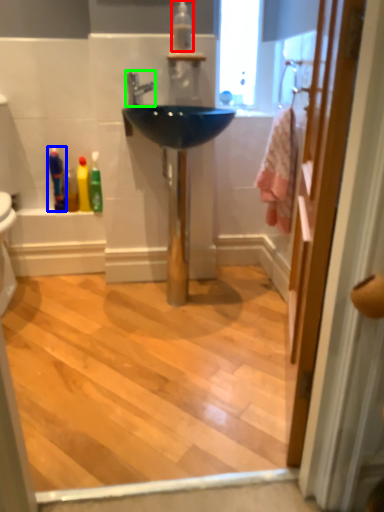
Question: Estimate the real-world distances between objects in this image. Which object is farther from mouthwash (highlighted by a red box), toiletry (highlighted by a blue box) or tap (highlighted by a green box)?

Choices:
 (A) toiletry
 (B) tap

Answer: (A)